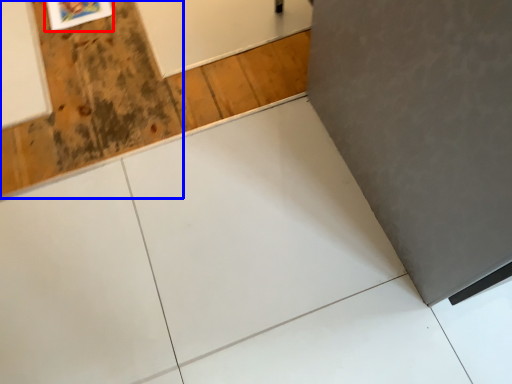
Question: Which object is further to the camera taking this photo, picture frame (highlighted by a red box) or plywood (highlighted by a blue box)?

Choices:
 (A) picture frame
 (B) plywood

Answer: (A)